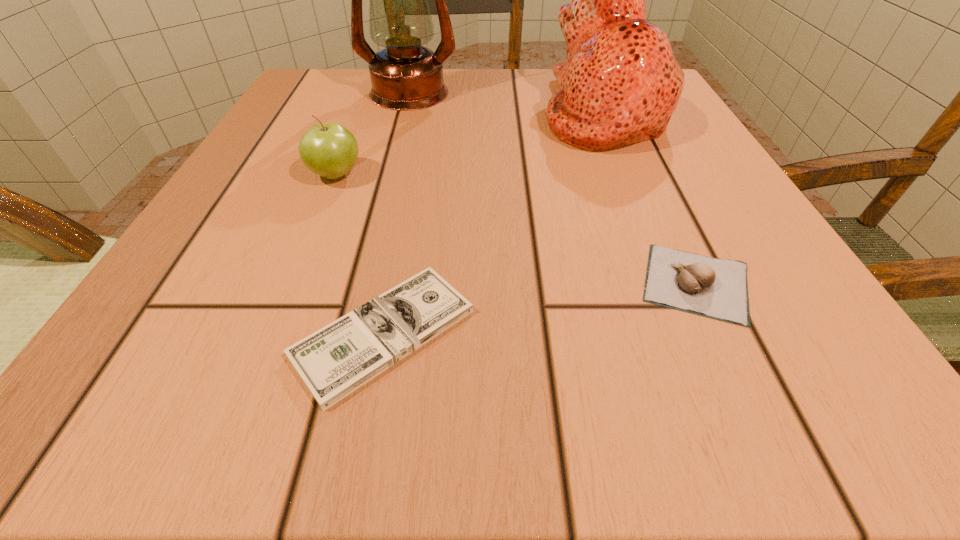
Locate an element on the screen. vacant space that satisfies the following two spatial constraints: 1. on the back side of the dollar; 2. on the left side of the second shortest object is located at coordinates (394, 283).

Locate an element on the screen. vacant position in the image that satisfies the following two spatial constraints: 1. on the face of the second tallest object; 2. on the right side of the second shortest object is located at coordinates (677, 283).

Find the location of a particular element. This screenshot has height=540, width=960. vacant position in the image that satisfies the following two spatial constraints: 1. on the back side of the garlic; 2. on the face of the cat is located at coordinates (615, 110).

Identify the location of vacant space that satisfies the following two spatial constraints: 1. on the face of the second shortest object; 2. on the left side of the second tallest object. (677, 283).